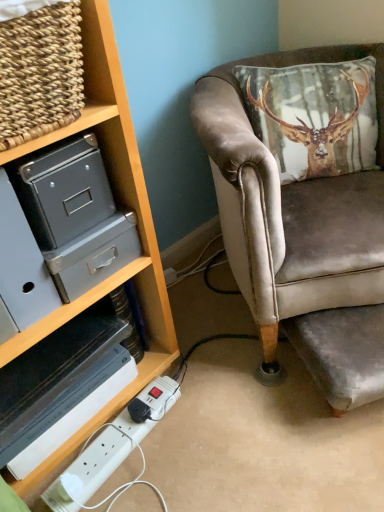
Question: Can you confirm if velvet brown chair at right is wider than white plastic extension cord at lower left?

Choices:
 (A) yes
 (B) no

Answer: (A)

Question: Does velvet brown chair at right come in front of white plastic extension cord at lower left?

Choices:
 (A) no
 (B) yes

Answer: (B)

Question: Is white plastic extension cord at lower left at the back of velvet brown chair at right?

Choices:
 (A) no
 (B) yes

Answer: (A)

Question: From the image's perspective, is velvet brown chair at right over white plastic extension cord at lower left?

Choices:
 (A) yes
 (B) no

Answer: (A)

Question: Does velvet brown chair at right come behind white plastic extension cord at lower left?

Choices:
 (A) no
 (B) yes

Answer: (A)

Question: Does velvet brown chair at right contain white plastic extension cord at lower left?

Choices:
 (A) yes
 (B) no

Answer: (B)

Question: Does white plastic extension cord at lower left turn towards velvet brown chair at right?

Choices:
 (A) no
 (B) yes

Answer: (A)

Question: From a real-world perspective, is white plastic extension cord at lower left positioned over velvet brown chair at right based on gravity?

Choices:
 (A) yes
 (B) no

Answer: (B)

Question: Considering the relative sizes of white plastic extension cord at lower left and velvet brown chair at right in the image provided, is white plastic extension cord at lower left taller than velvet brown chair at right?

Choices:
 (A) no
 (B) yes

Answer: (A)

Question: From a real-world perspective, is white plastic extension cord at lower left beneath velvet brown chair at right?

Choices:
 (A) no
 (B) yes

Answer: (B)

Question: Is the position of white plastic extension cord at lower left more distant than that of velvet brown chair at right?

Choices:
 (A) no
 (B) yes

Answer: (B)

Question: From the image's perspective, would you say white plastic extension cord at lower left is shown under velvet brown chair at right?

Choices:
 (A) yes
 (B) no

Answer: (A)

Question: Is white plastic extension cord at lower left positioned behind woven wood basket at upper left?

Choices:
 (A) yes
 (B) no

Answer: (A)